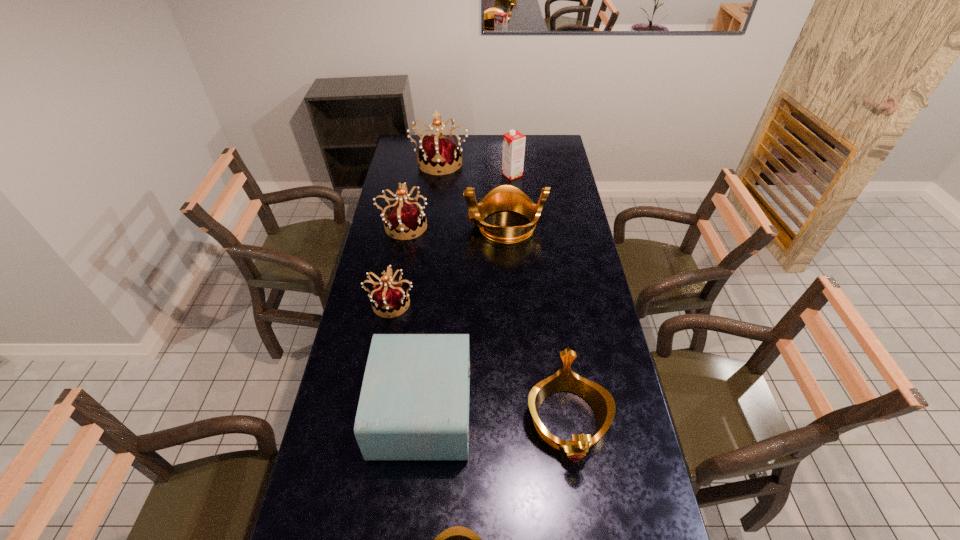
Locate an element on the screen. the tallest object is located at coordinates (440, 153).

Where is `the farthest red tiara`? the farthest red tiara is located at coordinates (440, 153).

You are a GUI agent. You are given a task and a screenshot of the screen. Output one action in this format:
    pyautogui.click(x=<x>, y=<y>)
    Task: Click on the carton
    The image size is (960, 540).
    Given the screenshot: What is the action you would take?
    pyautogui.click(x=513, y=142)

The width and height of the screenshot is (960, 540). What are the coordinates of `the second nearest red tiara` in the screenshot? It's located at (404, 217).

Identify the location of the farthest gold tiara. (506, 197).

The height and width of the screenshot is (540, 960). Identify the location of radio receiver. (414, 403).

Find the location of `the smallest red tiara`. the smallest red tiara is located at coordinates (389, 297).

You are a GUI agent. You are given a task and a screenshot of the screen. Output one action in this format:
    pyautogui.click(x=<x>, y=<y>)
    Task: Click on the nearest red tiara
    The image size is (960, 540).
    Given the screenshot: What is the action you would take?
    pyautogui.click(x=389, y=297)

Where is `the second nearest gold tiara`? This screenshot has height=540, width=960. the second nearest gold tiara is located at coordinates (601, 401).

Image resolution: width=960 pixels, height=540 pixels. In order to click on the second smallest gold tiara in this screenshot , I will do `click(601, 401)`.